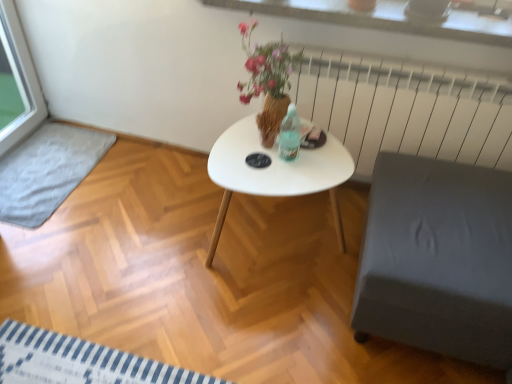
The image size is (512, 384). Identify the location of vacant area located to the right-hand side of gray fabric mat at lower left. (142, 201).